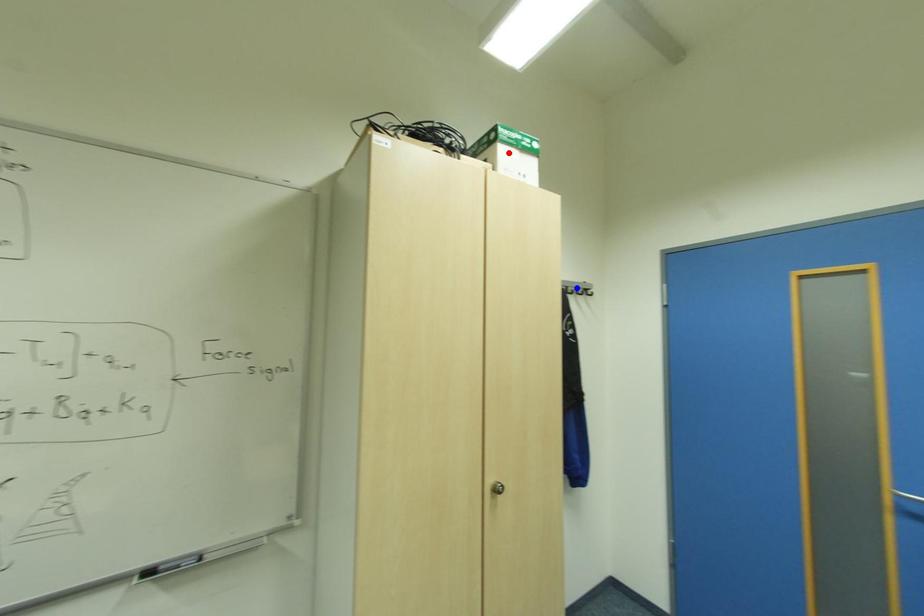
Question: Two points are marked on the image. Which point is closer to the camera?

Choices:
 (A) Blue point is closer.
 (B) Red point is closer.

Answer: (B)